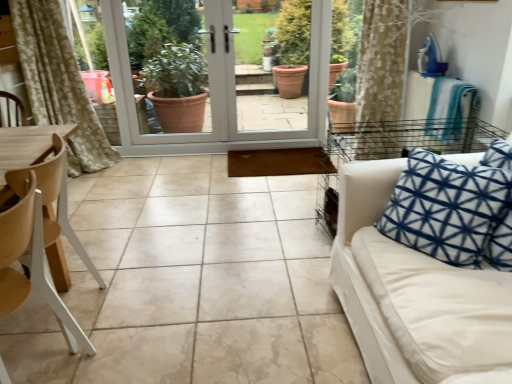
Locate an element on the screen. vacant area that lies to the right of wooden at left, the 2th chair in the front-to-back sequence is located at coordinates (137, 313).